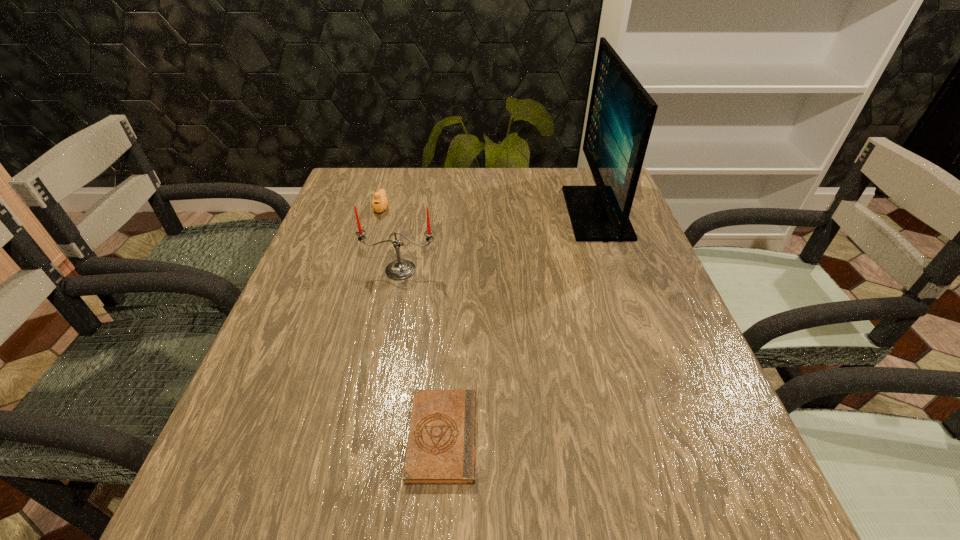
This screenshot has width=960, height=540. In the image, there is a desktop. Find the location of `free space at the far edge`. free space at the far edge is located at coordinates (396, 212).

In the image, there is a desktop. Find the location of `free space at the near edge`. free space at the near edge is located at coordinates (383, 483).

Image resolution: width=960 pixels, height=540 pixels. Identify the location of free region at the left edge of the desktop. coord(304,427).

This screenshot has height=540, width=960. In the image, there is a desktop. Find the location of `free space at the right edge`. free space at the right edge is located at coordinates (648, 386).

I want to click on vacant region at the far left corner of the desktop, so click(x=368, y=183).

Locate an element on the screen. This screenshot has width=960, height=540. free spot between the duckling and the monitor is located at coordinates (489, 211).

You are a GUI agent. You are given a task and a screenshot of the screen. Output one action in this format:
    pyautogui.click(x=<x>, y=<y>)
    Task: Click on the empty space that is in between the candle and the tallest object
    
    Given the screenshot: What is the action you would take?
    pyautogui.click(x=498, y=241)

Identify the location of free point between the monitor and the candle. (498, 241).

Locate an element on the screen. This screenshot has width=960, height=540. unoccupied area between the third shortest object and the shortest object is located at coordinates (421, 353).

Locate an element on the screen. The height and width of the screenshot is (540, 960). vacant space that's between the candle and the second shortest object is located at coordinates (391, 239).